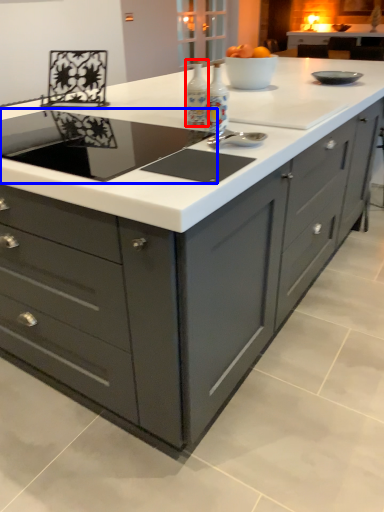
Question: Which object is closer to the camera taking this photo, appliance (highlighted by a red box) or home appliance (highlighted by a blue box)?

Choices:
 (A) appliance
 (B) home appliance

Answer: (B)